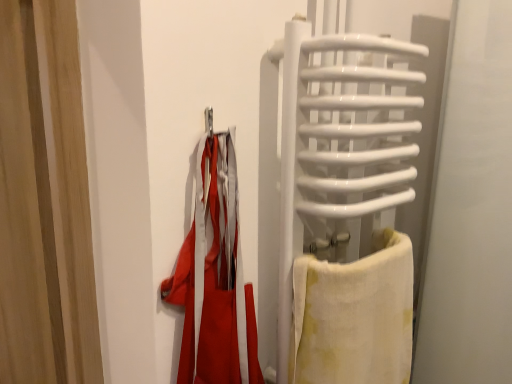
Question: From a real-world perspective, is wooden curtain at left on top of white glossy towel rack at right?

Choices:
 (A) yes
 (B) no

Answer: (B)

Question: Is white glossy towel rack at right at the back of wooden curtain at left?

Choices:
 (A) no
 (B) yes

Answer: (A)

Question: From a real-world perspective, does wooden curtain at left sit lower than white glossy towel rack at right?

Choices:
 (A) no
 (B) yes

Answer: (B)

Question: Does wooden curtain at left have a lesser height compared to white glossy towel rack at right?

Choices:
 (A) no
 (B) yes

Answer: (A)

Question: Is wooden curtain at left further to camera compared to white glossy towel rack at right?

Choices:
 (A) no
 (B) yes

Answer: (B)

Question: Based on their sizes in the image, would you say wooden curtain at left is bigger or smaller than white cotton towel at right?

Choices:
 (A) small
 (B) big

Answer: (B)

Question: Choose the correct answer: Is wooden curtain at left inside white cotton towel at right or outside it?

Choices:
 (A) inside
 (B) outside

Answer: (B)

Question: Is wooden curtain at left in front of or behind white cotton towel at right in the image?

Choices:
 (A) front
 (B) behind

Answer: (B)

Question: Looking at their shapes, would you say wooden curtain at left is wider or thinner than white cotton towel at right?

Choices:
 (A) wide
 (B) thin

Answer: (B)

Question: Considering the positions of white glossy towel rack at right and wooden curtain at left in the image, is white glossy towel rack at right taller or shorter than wooden curtain at left?

Choices:
 (A) tall
 (B) short

Answer: (B)

Question: In the image, is white glossy towel rack at right positioned in front of or behind wooden curtain at left?

Choices:
 (A) front
 (B) behind

Answer: (A)

Question: From a real-world perspective, relative to wooden curtain at left, is white glossy towel rack at right vertically above or below?

Choices:
 (A) below
 (B) above

Answer: (B)

Question: Visually, is white glossy towel rack at right positioned to the left or to the right of wooden curtain at left?

Choices:
 (A) left
 (B) right

Answer: (B)

Question: In the image, is white cotton towel at right positioned in front of or behind white glossy towel rack at right?

Choices:
 (A) front
 (B) behind

Answer: (B)

Question: Is white cotton towel at right inside or outside of white glossy towel rack at right?

Choices:
 (A) inside
 (B) outside

Answer: (A)